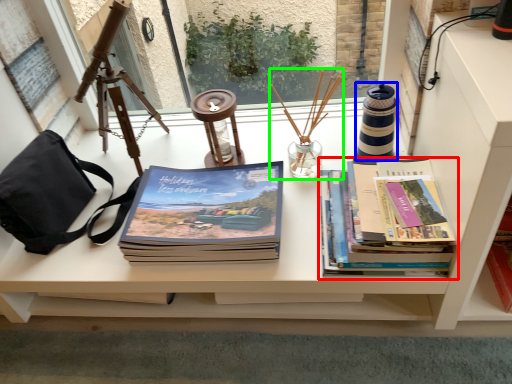
Question: Based on their relative distances, which object is farther from book (highlighted by a red box)? Choose from candle holder (highlighted by a blue box) and candle holder (highlighted by a green box).

Choices:
 (A) candle holder
 (B) candle holder

Answer: (B)